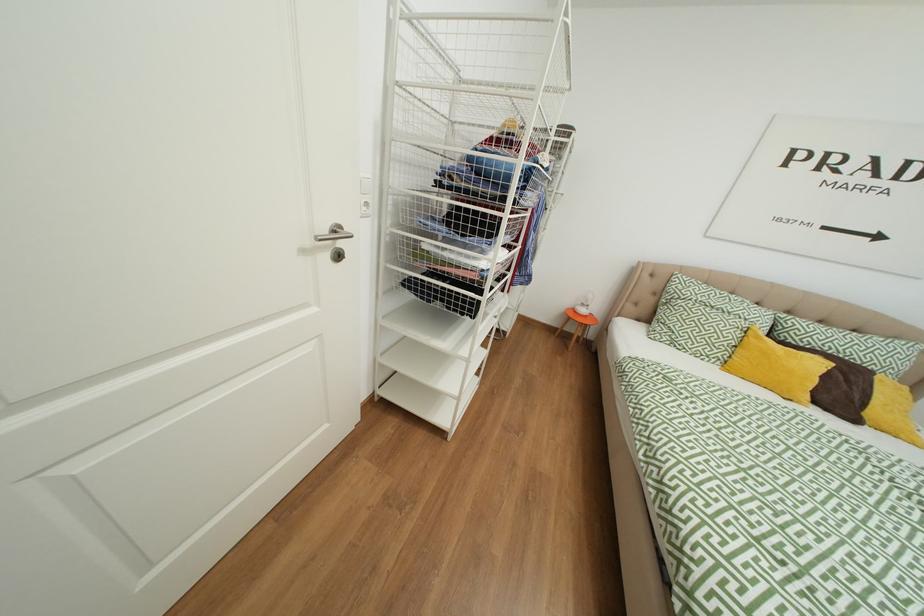
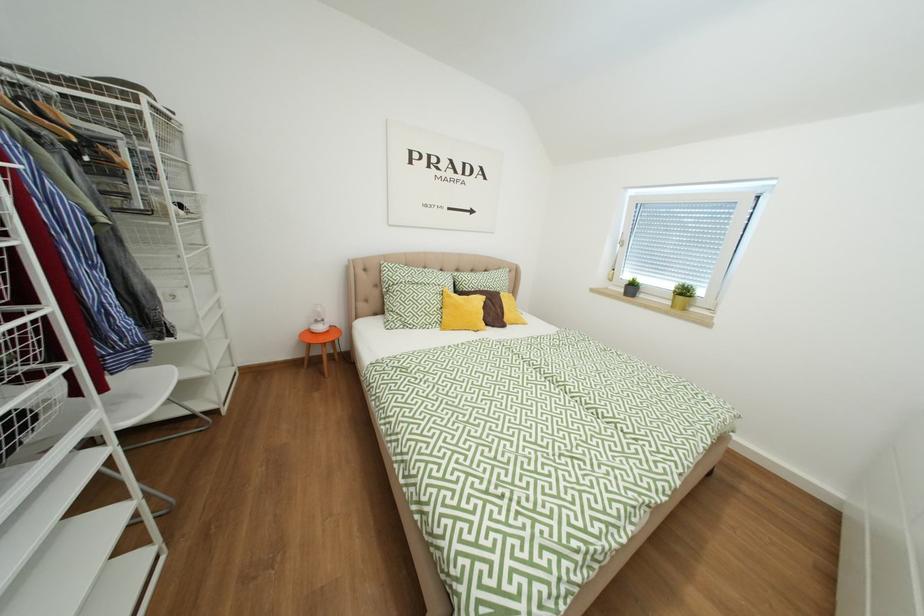
Question: Based on the continuous images, in which direction is the camera rotating? Reply with the corresponding letter.

Choices:
 (A) Left
 (B) Right
 (C) Up
 (D) Down

Answer: (B)